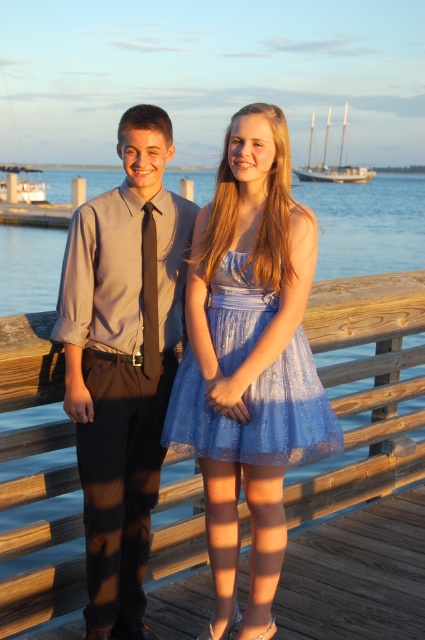
Can you confirm if matte gray shirt at center is shorter than matte black tie at center?

No.

Is matte gray shirt at center to the right of matte black tie at center from the viewer's perspective?

In fact, matte gray shirt at center is to the left of matte black tie at center.

Identify the location of matte gray shirt at center. (121, 365).

Does wooden at center appear under shiny blue tulle dress at center?

Yes.

How distant is wooden at center from shiny blue tulle dress at center?

wooden at center and shiny blue tulle dress at center are 4.53 feet apart from each other.

Does point (14, 625) lie behind point (212, 451)?

That is True.

Image resolution: width=425 pixels, height=640 pixels. I want to click on wooden at center, so click(x=365, y=388).

Does blue lace dress at center appear on the right side of wooden at center?

No, blue lace dress at center is not to the right of wooden at center.

Can you confirm if blue lace dress at center is positioned above wooden at center?

Indeed, blue lace dress at center is positioned over wooden at center.

Describe the element at coordinates (249, 362) in the screenshot. I see `blue lace dress at center` at that location.

Where is `blue lace dress at center`? The height and width of the screenshot is (640, 425). blue lace dress at center is located at coordinates (249, 362).